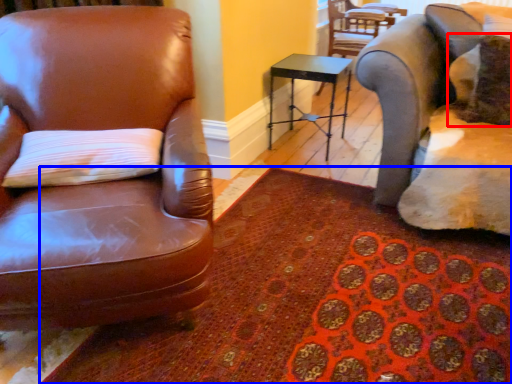
Question: Which of the following is the farthest to the observer, pillow (highlighted by a red box) or mat (highlighted by a blue box)?

Choices:
 (A) pillow
 (B) mat

Answer: (A)